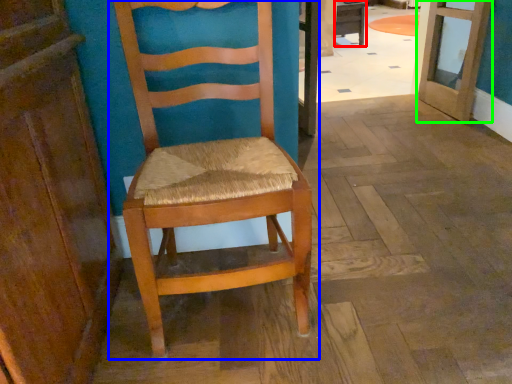
Question: Estimate the real-world distances between objects in this image. Which object is farther from table (highlighted by a red box), chair (highlighted by a blue box) or door (highlighted by a green box)?

Choices:
 (A) chair
 (B) door

Answer: (A)